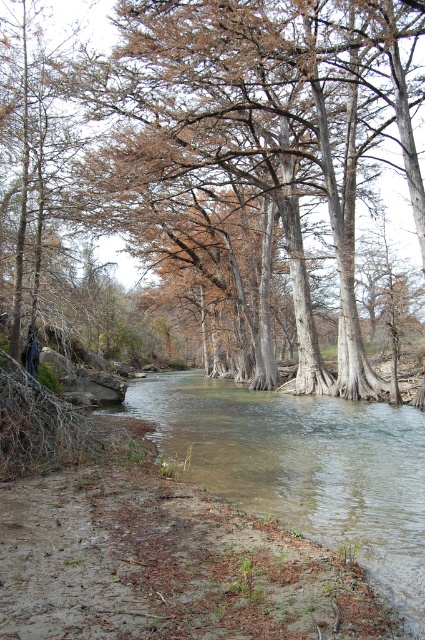
Measure the distance from brown wood tree at center to clear water at center.

brown wood tree at center is 47.54 feet away from clear water at center.

Is brown wood tree at center to the left of clear water at center from the viewer's perspective?

Indeed, brown wood tree at center is positioned on the left side of clear water at center.

Is point (402, 96) less distant than point (240, 493)?

No, (402, 96) is further to viewer.

At what (x,y) coordinates should I click in order to perform the action: click on brown wood tree at center. Please return your answer as a coordinate pair (x, y). This screenshot has height=640, width=425. Looking at the image, I should click on (212, 163).